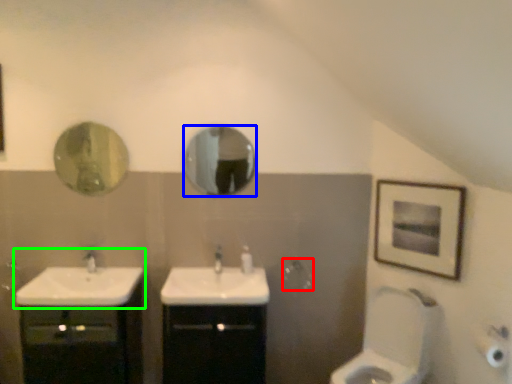
Question: Which object is positioned closest to towel bar (highlighted by a red box)? Select from mirror (highlighted by a blue box) and sink (highlighted by a green box).

Choices:
 (A) mirror
 (B) sink

Answer: (A)